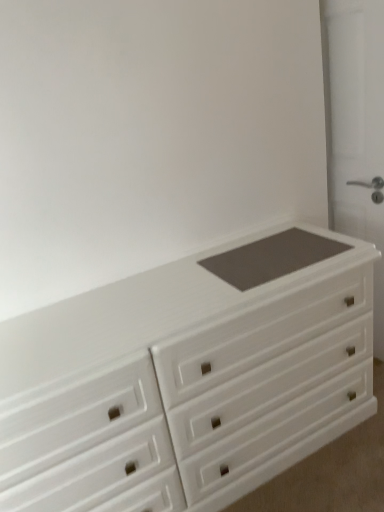
Question: Considering their positions, is white glossy chest of drawers at center located in front of or behind matte gray screen door at right?

Choices:
 (A) front
 (B) behind

Answer: (A)

Question: Is white glossy chest of drawers at center bigger or smaller than matte gray screen door at right?

Choices:
 (A) big
 (B) small

Answer: (A)

Question: From their relative heights in the image, would you say white glossy chest of drawers at center is taller or shorter than matte gray screen door at right?

Choices:
 (A) short
 (B) tall

Answer: (A)

Question: Considering the positions of point (379, 50) and point (220, 336), is point (379, 50) closer or farther from the camera than point (220, 336)?

Choices:
 (A) closer
 (B) farther

Answer: (B)

Question: From their relative heights in the image, would you say matte gray screen door at right is taller or shorter than white glossy chest of drawers at center?

Choices:
 (A) tall
 (B) short

Answer: (A)

Question: From a real-world perspective, is matte gray screen door at right above or below white glossy chest of drawers at center?

Choices:
 (A) above
 (B) below

Answer: (A)

Question: Is matte gray screen door at right inside the boundaries of white glossy chest of drawers at center, or outside?

Choices:
 (A) outside
 (B) inside

Answer: (A)